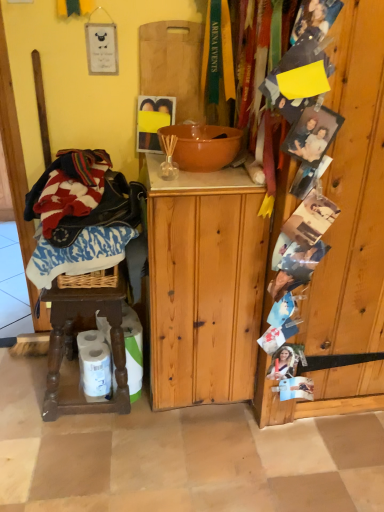
Question: Is natural wood cabinet at center spatially inside wooden photo display at right, or outside of it?

Choices:
 (A) outside
 (B) inside

Answer: (A)

Question: From the image's perspective, is natural wood cabinet at center positioned above or below wooden photo display at right?

Choices:
 (A) above
 (B) below

Answer: (B)

Question: Which is farther from the white glossy toilet paper at lower left, arranged as the first toilet paper when viewed from the right?

Choices:
 (A) wooden photo display at right
 (B) natural wood cabinet at center
 (C) orange ceramic bowl at center
 (D) wooden cutting board at upper center
 (E) white matte toilet paper at lower left, which is the first toilet paper in left-to-right order

Answer: (D)

Question: Estimate the real-world distances between objects in this image. Which object is closer to the wooden cutting board at upper center?

Choices:
 (A) brown wooden stool at lower left
 (B) wooden photo display at right
 (C) white matte toilet paper at lower left, which is the first toilet paper in left-to-right order
 (D) orange ceramic bowl at center
 (E) white glossy toilet paper at lower left, arranged as the first toilet paper when viewed from the right

Answer: (D)